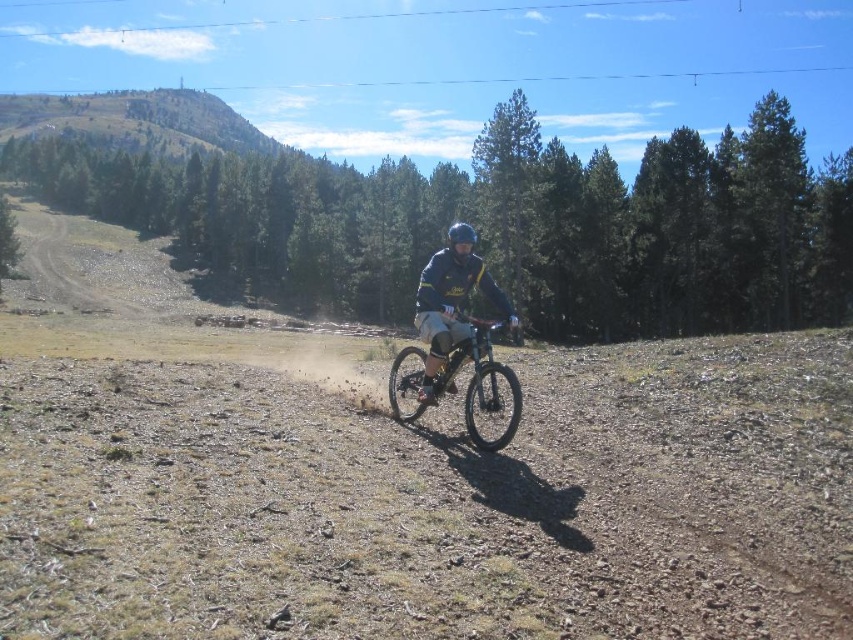
Does shiny metallic bicycle at center have a smaller size compared to dark blue jersey at center?

Indeed, shiny metallic bicycle at center has a smaller size compared to dark blue jersey at center.

Does shiny metallic bicycle at center have a lesser height compared to dark blue jersey at center?

Correct, shiny metallic bicycle at center is not as tall as dark blue jersey at center.

At what (x,y) coordinates should I click in order to perform the action: click on shiny metallic bicycle at center. Please return your answer as a coordinate pair (x, y). Image resolution: width=853 pixels, height=640 pixels. Looking at the image, I should click on (480, 381).

The height and width of the screenshot is (640, 853). I want to click on shiny metallic bicycle at center, so click(x=480, y=381).